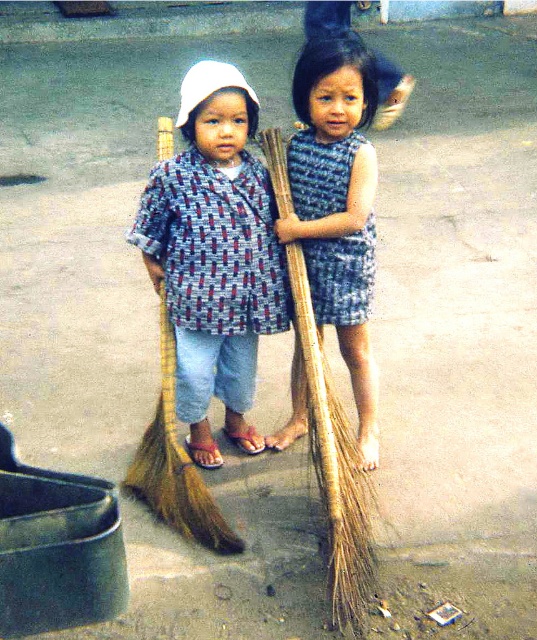
Describe the element at coordinates (214, 256) in the screenshot. Image resolution: width=537 pixels, height=640 pixels. I see `matte blue and red checkered shirt at center` at that location.

Does matte blue and red checkered shirt at center appear under blue textured dress at center?

Yes.

This screenshot has height=640, width=537. Find the location of `matte blue and red checkered shirt at center`. matte blue and red checkered shirt at center is located at coordinates (214, 256).